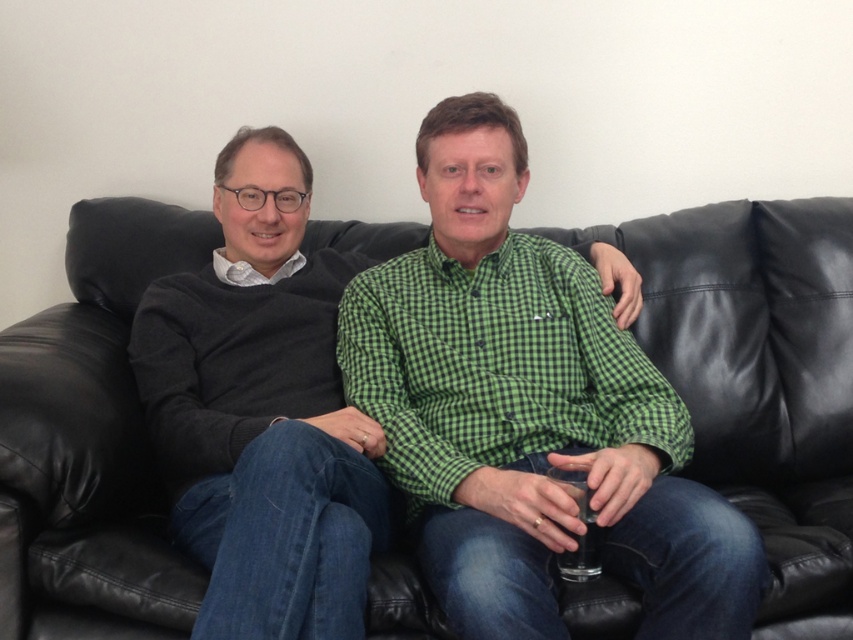
You are taking a photo of the two people on the black leather couch. You notice two points marked in the image. Which point, point (439, 166) or point (239, 284), is closer to the camera?

Point (439, 166) is closer to the camera than point (239, 284).

You are a photographer setting up for a group photo. You have two subjects wearing the green checkered shirt at center and dark gray sweater at left. Based on their clothing sizes, which subject should you position closer to the camera to maintain a balanced composition?

The green checkered shirt at center is smaller than the dark gray sweater at left, so positioning the subject in the green checkered shirt at center closer to the camera would help balance the composition by making them appear larger in the frame compared to the larger dark gray sweater at left.

You are a photographer setting up a shoot in this living room. You need to place a small table between the dark gray sweater at left and the black leather couch at center. Based on their positions, will the table fit snugly without overlapping either object?

The dark gray sweater at left is behind the black leather couch at center, so placing a table between them would not be possible as they are aligned along the same depth plane. The sweater is already positioned behind the couch, meaning there is no space in front of the couch to place the table without overlapping either object.